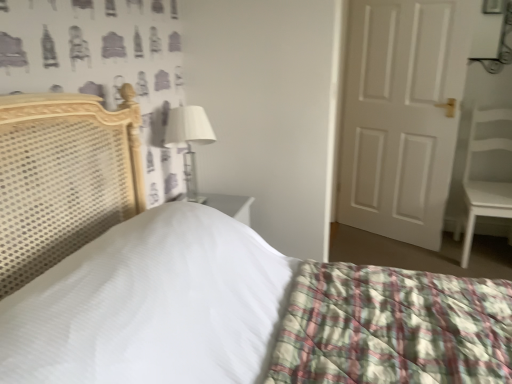
Question: Considering their positions, is white fabric-covered lampshade at upper center located in front of or behind white matte door at right?

Choices:
 (A) front
 (B) behind

Answer: (A)

Question: From a real-world perspective, is white fabric-covered lampshade at upper center physically located above or below white matte door at right?

Choices:
 (A) above
 (B) below

Answer: (A)

Question: Based on their relative distances, which object is nearer to the white fabric-covered lampshade at upper center?

Choices:
 (A) white matte chair at right
 (B) white matte door at right

Answer: (B)

Question: Estimate the real-world distances between objects in this image. Which object is closer to the white fabric-covered lampshade at upper center?

Choices:
 (A) white matte door at right
 (B) white matte chair at right

Answer: (A)